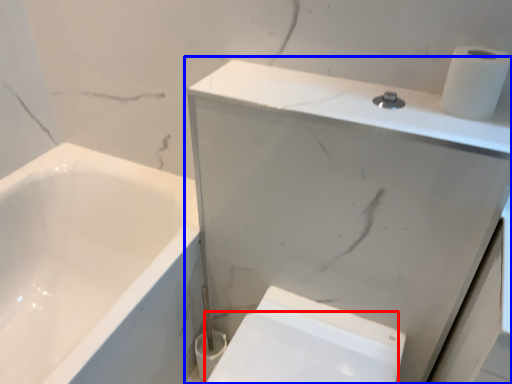
Question: Among these objects, which one is farthest to the camera, bidet (highlighted by a red box) or medicine cabinet (highlighted by a blue box)?

Choices:
 (A) bidet
 (B) medicine cabinet

Answer: (A)